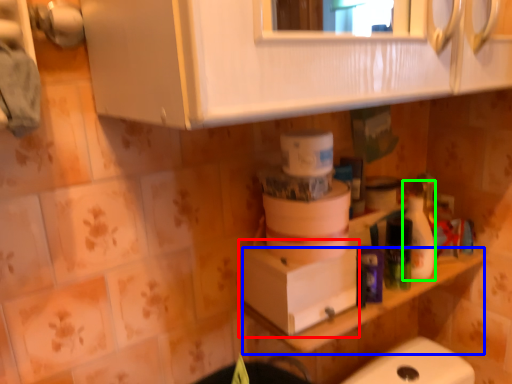
Question: Which object is the farthest from cardboard box (highlighted by a red box)? Choose among these: counter top (highlighted by a blue box) or cleaning product (highlighted by a green box).

Choices:
 (A) counter top
 (B) cleaning product

Answer: (B)